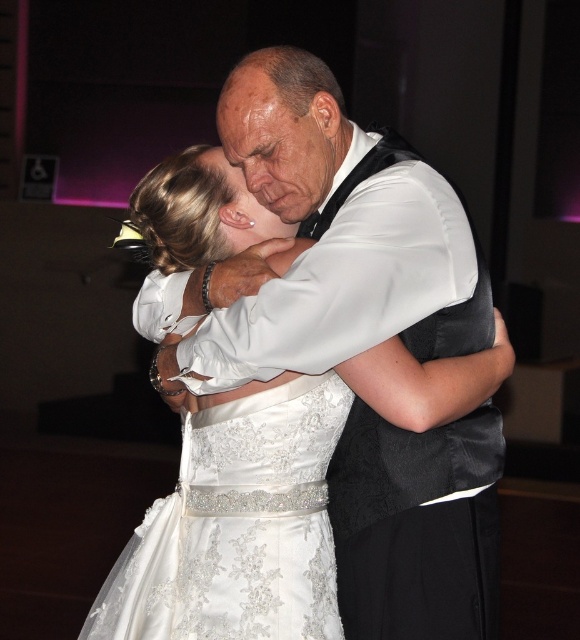
Question: Which point is closer to the camera taking this photo?

Choices:
 (A) (147, 196)
 (B) (194, 515)

Answer: (B)

Question: Is the position of white satin dress at center more distant than that of satin/embroidered wedding dress at center?

Choices:
 (A) yes
 (B) no

Answer: (B)

Question: Among these points, which one is farthest from the camera?

Choices:
 (A) (369, 358)
 (B) (183, 513)

Answer: (B)

Question: Can you confirm if white satin dress at center is bigger than satin/embroidered wedding dress at center?

Choices:
 (A) no
 (B) yes

Answer: (B)

Question: Does white satin dress at center appear on the right side of satin/embroidered wedding dress at center?

Choices:
 (A) no
 (B) yes

Answer: (B)